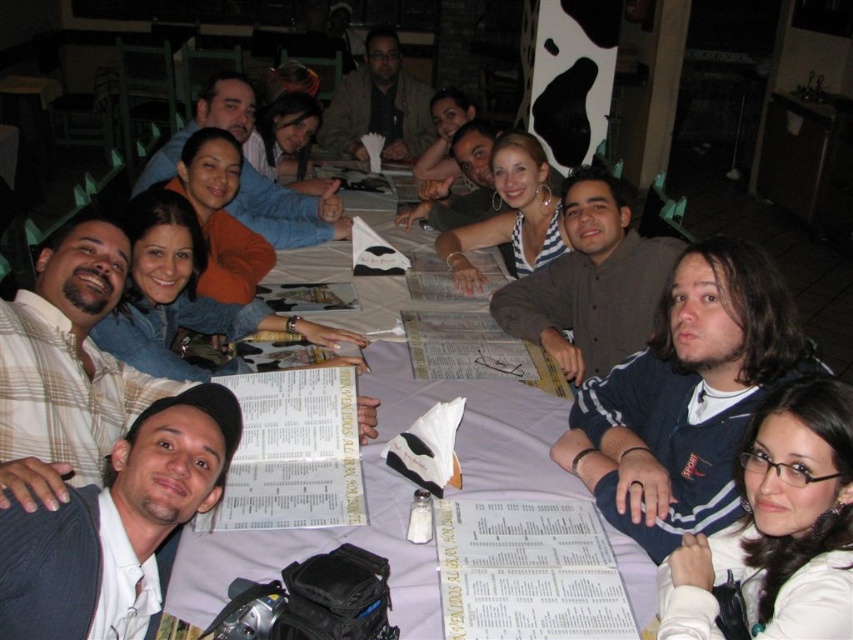
Is point (622, 346) more distant than point (363, 108)?

That is False.

What do you see at coordinates (590, 282) in the screenshot? The height and width of the screenshot is (640, 853). I see `striped fabric shirt at center` at bounding box center [590, 282].

Who is more forward, (566, 257) or (392, 140)?

Point (566, 257)

The height and width of the screenshot is (640, 853). I want to click on striped fabric shirt at center, so click(x=590, y=282).

Which is in front, point (73, 637) or point (393, 120)?

Point (73, 637) is in front.

Does dark gray knit cap at lower left appear on the right side of brown textured jacket at center?

No, dark gray knit cap at lower left is not to the right of brown textured jacket at center.

Where is `dark gray knit cap at lower left`? dark gray knit cap at lower left is located at coordinates (173, 464).

Can you confirm if white paper table at center is positioned below striped fabric top at center?

Yes.

This screenshot has height=640, width=853. Describe the element at coordinates (393, 493) in the screenshot. I see `white paper table at center` at that location.

The width and height of the screenshot is (853, 640). I want to click on white paper table at center, so click(393, 493).